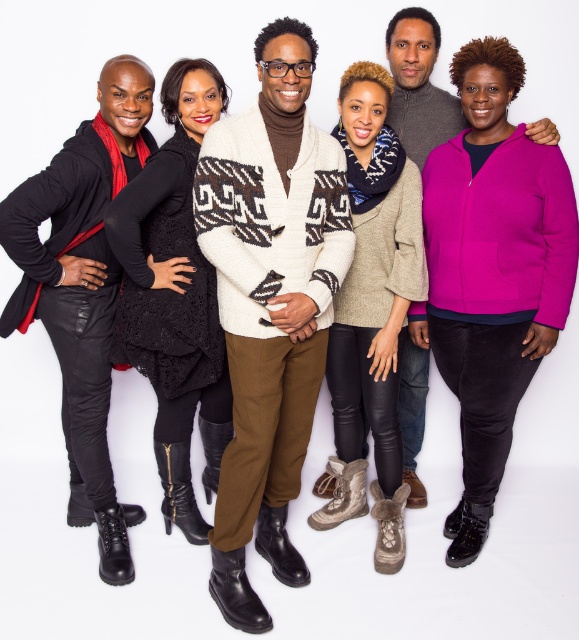
Does fuzzy pink zip-up sweater at center-right have a larger size compared to knitted beige sweater at center?

No, fuzzy pink zip-up sweater at center-right is not bigger than knitted beige sweater at center.

Does fuzzy pink zip-up sweater at center-right appear on the left side of knitted beige sweater at center?

In fact, fuzzy pink zip-up sweater at center-right is to the right of knitted beige sweater at center.

Is point (522, 358) less distant than point (336, 444)?

That is True.

At what (x,y) coordinates should I click in order to perform the action: click on fuzzy pink zip-up sweater at center-right. Please return your answer as a coordinate pair (x, y). The image size is (579, 640). Looking at the image, I should click on (492, 272).

What do you see at coordinates (492, 272) in the screenshot? The width and height of the screenshot is (579, 640). I see `fuzzy pink zip-up sweater at center-right` at bounding box center [492, 272].

Does point (518, 285) lie in front of point (32, 308)?

Yes, it is.

Is point (540, 218) more distant than point (90, 502)?

No, (540, 218) is closer to viewer.

You are a GUI agent. You are given a task and a screenshot of the screen. Output one action in this format:
    pyautogui.click(x=<x>, y=<y>)
    Task: Click on the fuzzy pink zip-up sweater at center-right
    The width and height of the screenshot is (579, 640).
    Given the screenshot: What is the action you would take?
    pyautogui.click(x=492, y=272)

Which is above, black lace dress at center or knitted beige sweater at center?

black lace dress at center is above.

What do you see at coordinates (174, 296) in the screenshot? The image size is (579, 640). I see `black lace dress at center` at bounding box center [174, 296].

Is point (166, 280) closer to viewer compared to point (338, 502)?

That is True.

At what (x,y) coordinates should I click in order to perform the action: click on black lace dress at center. Please return your answer as a coordinate pair (x, y). This screenshot has width=579, height=640. Looking at the image, I should click on (174, 296).